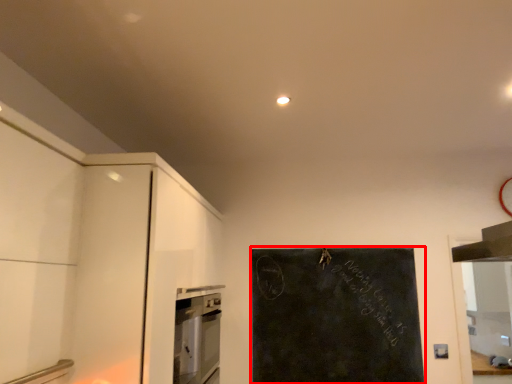
Question: In this image, where is bulletin board (annotated by the red box) located relative to home appliance?

Choices:
 (A) right
 (B) left

Answer: (A)